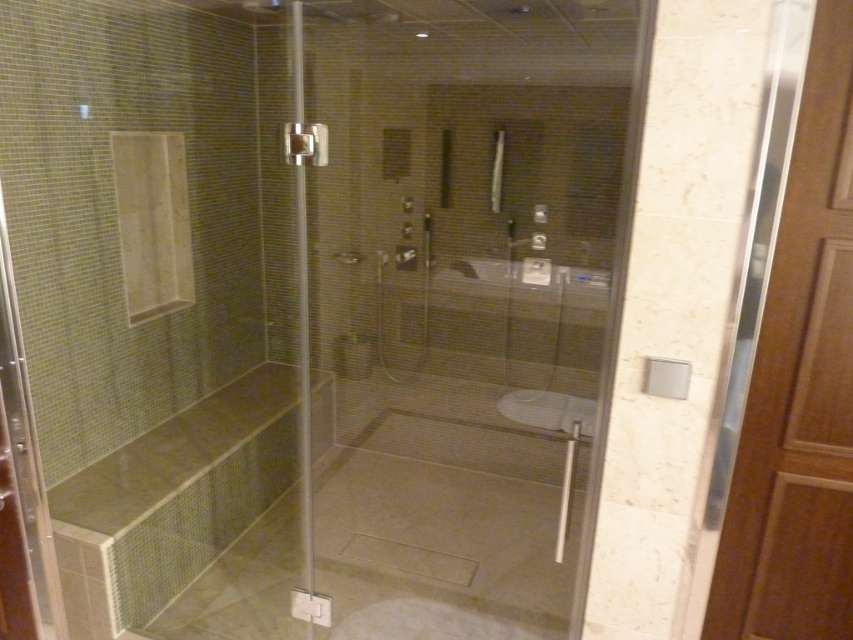
Question: Among these points, which one is farthest from the camera?

Choices:
 (A) (772, 481)
 (B) (549, 564)

Answer: (B)

Question: Is transparent glass door at center wider than clear glass screen door at right?

Choices:
 (A) no
 (B) yes

Answer: (B)

Question: Which point appears farthest from the camera in this image?

Choices:
 (A) (798, 211)
 (B) (323, 131)
 (C) (517, 564)

Answer: (C)

Question: Is transparent glass door at center behind clear glass screen door at right?

Choices:
 (A) no
 (B) yes

Answer: (B)

Question: Among these points, which one is farthest from the camera?

Choices:
 (A) (828, 145)
 (B) (619, 129)

Answer: (B)

Question: Where is transparent glass door at center located in relation to clear glass screen door at right in the image?

Choices:
 (A) right
 (B) left

Answer: (B)